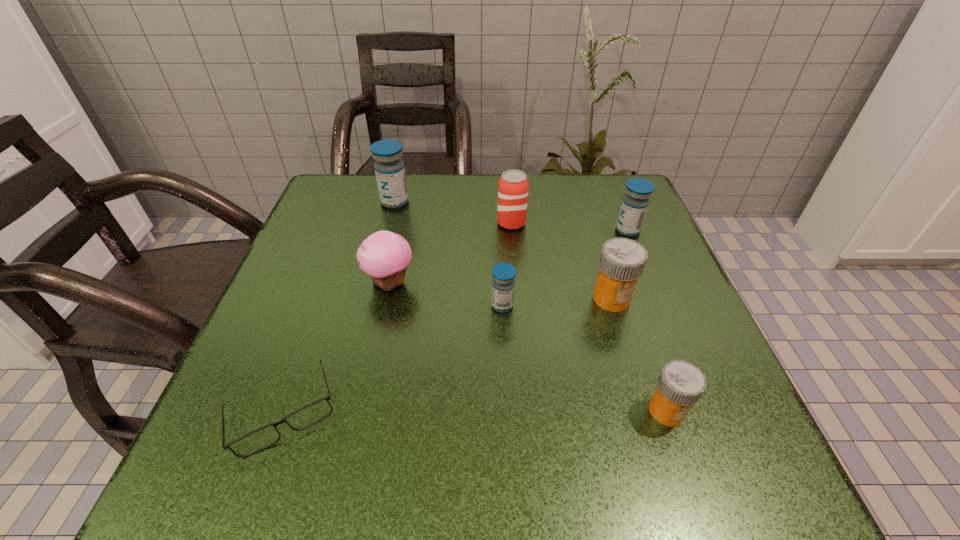
Locate an element on the screen. The width and height of the screenshot is (960, 540). the farthest blue medicine is located at coordinates coord(389,168).

You are a GUI agent. You are given a task and a screenshot of the screen. Output one action in this format:
    pyautogui.click(x=<x>, y=<y>)
    Task: Click on the leftmost medicine
    The width and height of the screenshot is (960, 540).
    Given the screenshot: What is the action you would take?
    pyautogui.click(x=389, y=168)

The height and width of the screenshot is (540, 960). In order to click on orange beer can in this screenshot , I will do `click(513, 187)`.

You are a GUI agent. You are given a task and a screenshot of the screen. Output one action in this format:
    pyautogui.click(x=<x>, y=<y>)
    Task: Click on the second nearest blue medicine
    
    Given the screenshot: What is the action you would take?
    pyautogui.click(x=635, y=202)

You are a GUI agent. You are given a task and a screenshot of the screen. Output one action in this format:
    pyautogui.click(x=<x>, y=<y>)
    Task: Click on the second smallest blue medicine
    The width and height of the screenshot is (960, 540).
    Given the screenshot: What is the action you would take?
    pyautogui.click(x=635, y=202)

The height and width of the screenshot is (540, 960). I want to click on the bigger orange medicine, so click(x=622, y=260).

Where is `cupcake`? cupcake is located at coordinates (384, 255).

Where is `the nearest blue medicine`? the nearest blue medicine is located at coordinates (503, 283).

Find the location of a particular element. This screenshot has width=960, height=540. the smallest blue medicine is located at coordinates (503, 283).

Find the location of a particular element. This screenshot has height=540, width=960. the nearest medicine is located at coordinates (680, 384).